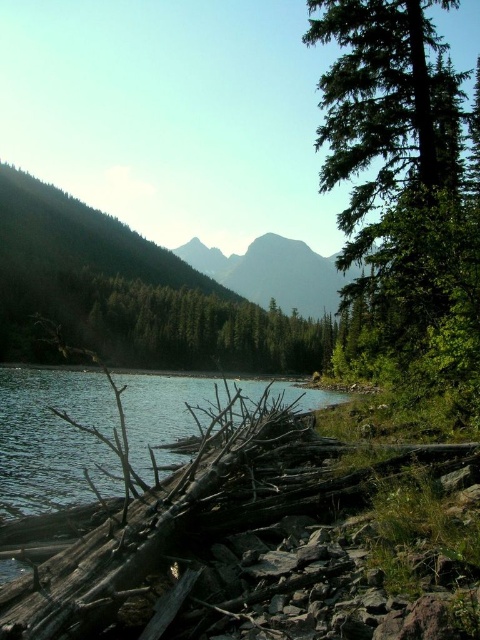
You are standing at the camera position looking at the green textured tree at right. If you want to reach it within 10 seconds, what is the minimum speed you need to walk at?

The green textured tree at right is 37.41 feet away from camera. To reach it within 10 seconds, you need to walk at a minimum speed of 3.74 feet per second.

You are an environmental scientist observing the landscape. You notice the green textured tree at right and the green matte tree at center. Which tree would cast a shorter shadow during midday when the sun is directly overhead?

The green textured tree at right is smaller than the green matte tree at center, so it would cast a shorter shadow during midday when the sun is directly overhead.